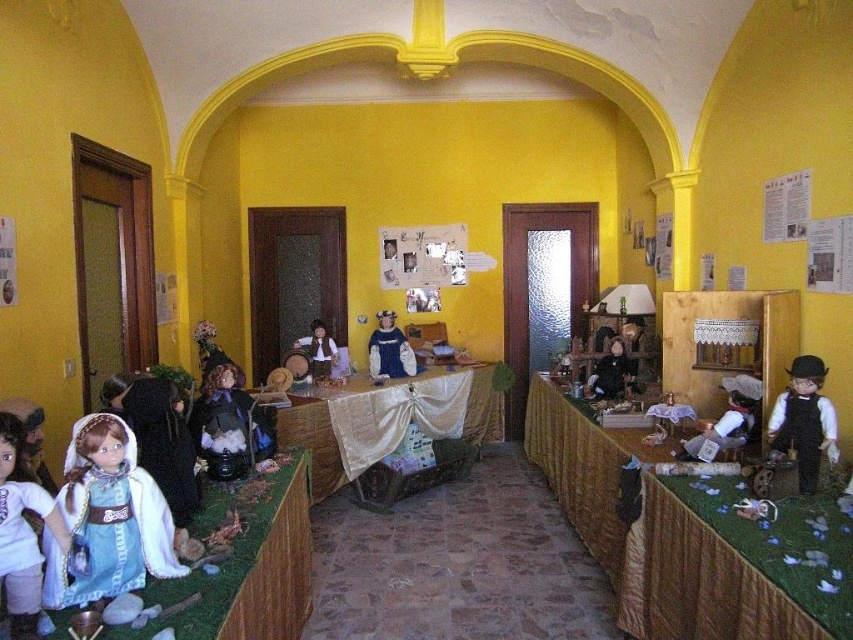
From the picture: You are a miniature collector who wants to place a new accessory between the matte blue dress at center and the matte black doll at center. If your accessory is 1.2 meters long, will it fit between them without overlapping either?

The distance between the matte blue dress at center and the matte black doll at center is 1.44 meters. Since the accessory is 1.2 meters long, it will fit between them with 0.24 meters of space remaining.

You are a guest in this miniature room and want to place a small vase between the matte blue dress at center and the matte black doll at center. Since the vase is 10 cm tall, will it fit without overlapping either object?

The matte blue dress at center is taller than the matte black doll at center. Since the vase is only 10 cm tall, it can be placed between them as long as its height does not exceed the shorter object, which is the matte black doll. However, the exact height of the doll is not provided, so we cannot confirm if 10 cm is suitable. Please ensure the vase is shorter than the doll.

You are organizing a miniature tea party in the dollhouse room. You have a white lace cloth at center and a matte black doll at center. Which object should you place first to ensure proper fitting on the table?

The white lace cloth at center should be placed first because it is larger in size than the matte black doll at center, ensuring there is enough space for both items on the table.